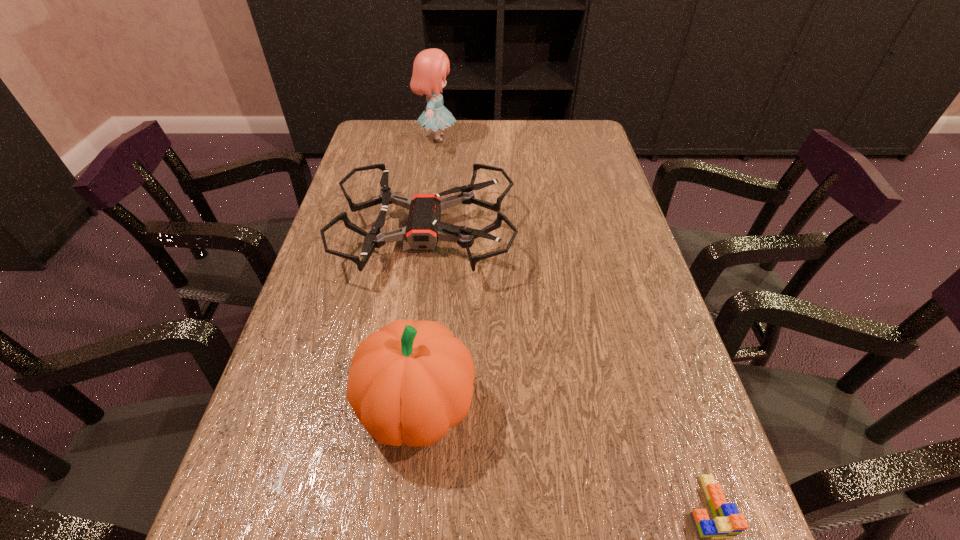
The height and width of the screenshot is (540, 960). Find the location of `free region located with the camera facing forward on the third tallest object`. free region located with the camera facing forward on the third tallest object is located at coordinates (573, 234).

Where is `blank space located 0.130m on the back of the rightmost object`? This screenshot has height=540, width=960. blank space located 0.130m on the back of the rightmost object is located at coordinates (671, 402).

The width and height of the screenshot is (960, 540). Identify the location of object located in the far edge section of the desktop. (430, 67).

In order to click on object present at the left edge in this screenshot , I will do click(424, 228).

Image resolution: width=960 pixels, height=540 pixels. In order to click on object at the right edge in this screenshot , I will do tap(727, 523).

In order to click on free space at the far edge in this screenshot , I will do `click(527, 128)`.

This screenshot has height=540, width=960. I want to click on vacant region at the left edge of the desktop, so [x=373, y=296].

You are a GUI agent. You are given a task and a screenshot of the screen. Output one action in this format:
    pyautogui.click(x=<x>, y=<y>)
    Task: Click on the vacant space at the right edge of the desktop
    The height and width of the screenshot is (540, 960).
    Given the screenshot: What is the action you would take?
    pyautogui.click(x=633, y=301)

You are a GUI agent. You are given a task and a screenshot of the screen. Output one action in this format:
    pyautogui.click(x=<x>, y=<y>)
    Task: Click on the vacant space at the far left corner
    This screenshot has width=960, height=540.
    Given the screenshot: What is the action you would take?
    point(400,152)

Locate an element on the screen. The height and width of the screenshot is (540, 960). free space between the pumpkin and the shortest object is located at coordinates (562, 456).